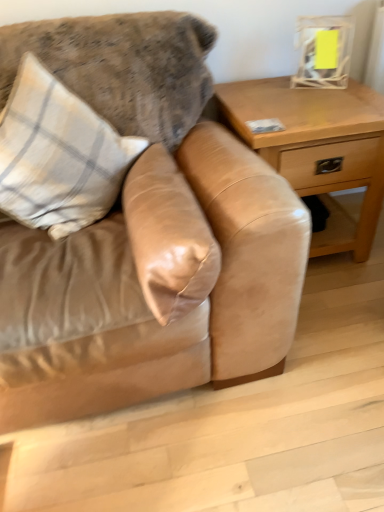
The image size is (384, 512). I want to click on suede couch at center, so click(x=147, y=238).

What do you see at coordinates (318, 148) in the screenshot? I see `light brown wood table at right` at bounding box center [318, 148].

Locate an element on the screen. The height and width of the screenshot is (512, 384). suede pillow at center, which is the 2th pillow from left to right is located at coordinates (168, 236).

Is the surface of suede pillow at center, which is the 2th pillow from left to right, in direct contact with light brown wood table at right?

No, suede pillow at center, which is the 2th pillow from left to right, is not in contact with light brown wood table at right.

Is suede pillow at center, which is the 2th pillow from left to right, positioned with its back to light brown wood table at right?

No, suede pillow at center, which is the 2th pillow from left to right,'s orientation is not away from light brown wood table at right.

In the scene shown: Considering the positions of objects suede pillow at center, which is the 2th pillow from left to right, and light brown wood table at right in the image provided, who is more to the right, suede pillow at center, which is the 2th pillow from left to right, or light brown wood table at right?

From the viewer's perspective, light brown wood table at right appears more on the right side.

Considering the points (210, 247) and (352, 126), which point is behind, point (210, 247) or point (352, 126)?

The point (352, 126) is farther from the camera.

Between point (137, 191) and point (140, 245), which one is positioned behind?

The point (137, 191) is behind.

From a real-world perspective, which is physically above, suede pillow at center, which is the 2th pillow from left to right, or suede couch at center?

suede pillow at center, which is the 2th pillow from left to right, from a real-world perspective.

Is the surface of suede pillow at center, which is the 2th pillow from left to right, in direct contact with suede couch at center?

No, suede pillow at center, which is the 2th pillow from left to right, is not next to suede couch at center.

Which object is positioned more to the left, suede pillow at center, which is the 2th pillow from left to right, or suede couch at center?

From the viewer's perspective, suede couch at center appears more on the left side.

From the image's perspective, which one is positioned lower, plaid fabric pillow at upper left, positioned as the 2th pillow in right-to-left order, or light brown wood table at right?

plaid fabric pillow at upper left, positioned as the 2th pillow in right-to-left order.

Between plaid fabric pillow at upper left, positioned as the 2th pillow in right-to-left order, and light brown wood table at right, which one is positioned behind?

light brown wood table at right.

Which object is wider, plaid fabric pillow at upper left, positioned as the 2th pillow in right-to-left order, or light brown wood table at right?

With larger width is light brown wood table at right.

Is plaid fabric pillow at upper left, the first pillow viewed from the left, facing towards light brown wood table at right?

No, plaid fabric pillow at upper left, the first pillow viewed from the left, does not turn towards light brown wood table at right.

From a real-world perspective, is suede pillow at center, which ranks as the 1th pillow in right-to-left order, positioned above or below plaid fabric pillow at upper left, positioned as the 2th pillow in right-to-left order?

suede pillow at center, which ranks as the 1th pillow in right-to-left order, is situated lower than plaid fabric pillow at upper left, positioned as the 2th pillow in right-to-left order, in the real world.

Is suede pillow at center, which ranks as the 1th pillow in right-to-left order, with plaid fabric pillow at upper left, positioned as the 2th pillow in right-to-left order?

No, suede pillow at center, which ranks as the 1th pillow in right-to-left order, is not in contact with plaid fabric pillow at upper left, positioned as the 2th pillow in right-to-left order.

Is suede pillow at center, which is the 2th pillow from left to right, oriented away from plaid fabric pillow at upper left, the first pillow viewed from the left?

No, suede pillow at center, which is the 2th pillow from left to right, is not facing away from plaid fabric pillow at upper left, the first pillow viewed from the left.

Is plaid fabric pillow at upper left, the first pillow viewed from the left, at the left side of suede pillow at center, which is the 2th pillow from left to right?

Yes, plaid fabric pillow at upper left, the first pillow viewed from the left, is to the left of suede pillow at center, which is the 2th pillow from left to right.

Is plaid fabric pillow at upper left, the first pillow viewed from the left, wider than suede pillow at center, which is the 2th pillow from left to right?

Indeed, plaid fabric pillow at upper left, the first pillow viewed from the left, has a greater width compared to suede pillow at center, which is the 2th pillow from left to right.

Identify the location of pillow directly beneath the plaid fabric pillow at upper left, positioned as the 2th pillow in right-to-left order (from a real-world perspective). The height and width of the screenshot is (512, 384). (168, 236).

Is plaid fabric pillow at upper left, the first pillow viewed from the left, facing towards suede pillow at center, which ranks as the 1th pillow in right-to-left order?

Yes, plaid fabric pillow at upper left, the first pillow viewed from the left, faces towards suede pillow at center, which ranks as the 1th pillow in right-to-left order.

From a real-world perspective, is light brown wood table at right positioned under plaid fabric pillow at upper left, the first pillow viewed from the left, based on gravity?

Yes, from a real-world perspective, light brown wood table at right is beneath plaid fabric pillow at upper left, the first pillow viewed from the left.

Is light brown wood table at right closer to camera compared to plaid fabric pillow at upper left, positioned as the 2th pillow in right-to-left order?

No.

Looking at their sizes, would you say light brown wood table at right is wider or thinner than plaid fabric pillow at upper left, positioned as the 2th pillow in right-to-left order?

In the image, light brown wood table at right appears to be wider than plaid fabric pillow at upper left, positioned as the 2th pillow in right-to-left order.

From their relative heights in the image, would you say light brown wood table at right is taller or shorter than plaid fabric pillow at upper left, positioned as the 2th pillow in right-to-left order?

light brown wood table at right is taller than plaid fabric pillow at upper left, positioned as the 2th pillow in right-to-left order.

Is suede couch at center beside light brown wood table at right?

No.

Considering the positions of points (139, 131) and (341, 222), is point (139, 131) farther from camera compared to point (341, 222)?

That is False.

Is suede couch at center at the left side of light brown wood table at right?

Indeed, suede couch at center is positioned on the left side of light brown wood table at right.

Does suede couch at center have a lesser width compared to light brown wood table at right?

In fact, suede couch at center might be wider than light brown wood table at right.

The image size is (384, 512). Find the location of `table on the right of the suede pillow at center, which ranks as the 1th pillow in right-to-left order`. table on the right of the suede pillow at center, which ranks as the 1th pillow in right-to-left order is located at coordinates (318, 148).

At what (x,y) coordinates should I click in order to perform the action: click on studio couch below the suede pillow at center, which is the 2th pillow from left to right (from a real-world perspective). Please return your answer as a coordinate pair (x, y). Image resolution: width=384 pixels, height=512 pixels. Looking at the image, I should click on (147, 238).

Which object lies nearer to the anchor point light brown wood table at right, suede pillow at center, which is the 2th pillow from left to right, or suede couch at center?

Among the two, suede couch at center is located nearer to light brown wood table at right.

When comparing their distances from plaid fabric pillow at upper left, positioned as the 2th pillow in right-to-left order, does suede couch at center or suede pillow at center, which is the 2th pillow from left to right, seem closer?

suede couch at center is positioned closer to the anchor plaid fabric pillow at upper left, positioned as the 2th pillow in right-to-left order.

Estimate the real-world distances between objects in this image. Which object is closer to suede pillow at center, which ranks as the 1th pillow in right-to-left order, suede couch at center or plaid fabric pillow at upper left, positioned as the 2th pillow in right-to-left order?

Based on the image, suede couch at center appears to be nearer to suede pillow at center, which ranks as the 1th pillow in right-to-left order.

Looking at the image, which one is located further to light brown wood table at right, plaid fabric pillow at upper left, the first pillow viewed from the left, or suede pillow at center, which ranks as the 1th pillow in right-to-left order?

plaid fabric pillow at upper left, the first pillow viewed from the left, is further to light brown wood table at right.

From the image, which object appears to be farther from suede couch at center, suede pillow at center, which is the 2th pillow from left to right, or plaid fabric pillow at upper left, the first pillow viewed from the left?

plaid fabric pillow at upper left, the first pillow viewed from the left, is positioned further to the anchor suede couch at center.

Estimate the real-world distances between objects in this image. Which object is closer to suede pillow at center, which is the 2th pillow from left to right, suede couch at center or light brown wood table at right?

Based on the image, suede couch at center appears to be nearer to suede pillow at center, which is the 2th pillow from left to right.

Estimate the real-world distances between objects in this image. Which object is further from suede couch at center, light brown wood table at right or plaid fabric pillow at upper left, positioned as the 2th pillow in right-to-left order?

light brown wood table at right is positioned further to the anchor suede couch at center.

When comparing their distances from suede pillow at center, which ranks as the 1th pillow in right-to-left order, does plaid fabric pillow at upper left, the first pillow viewed from the left, or suede couch at center seem further?

plaid fabric pillow at upper left, the first pillow viewed from the left, lies further to suede pillow at center, which ranks as the 1th pillow in right-to-left order, than the other object.

The width and height of the screenshot is (384, 512). Identify the location of pillow between plaid fabric pillow at upper left, positioned as the 2th pillow in right-to-left order, and light brown wood table at right, in the horizontal direction. (168, 236).

I want to click on studio couch situated between plaid fabric pillow at upper left, positioned as the 2th pillow in right-to-left order, and light brown wood table at right from left to right, so click(x=147, y=238).

Identify the location of pillow positioned between suede couch at center and plaid fabric pillow at upper left, positioned as the 2th pillow in right-to-left order, from near to far. The width and height of the screenshot is (384, 512). (168, 236).